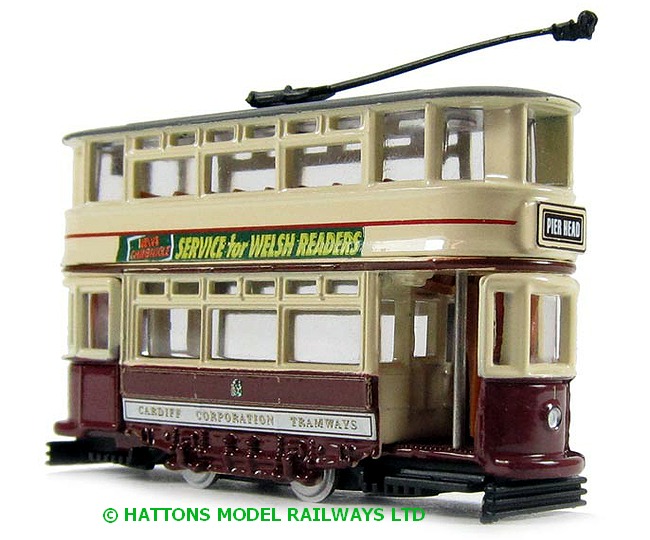
Image resolution: width=650 pixels, height=540 pixels. I want to click on window, so click(81, 341).